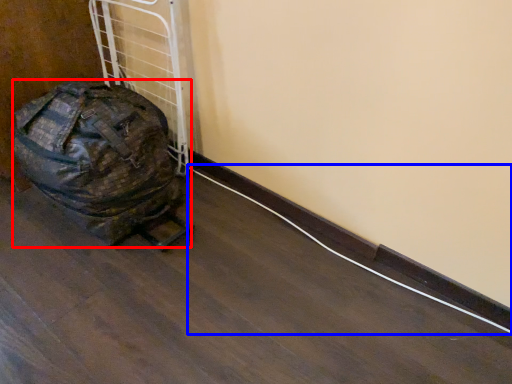
Question: Which point is further to the camera, luggage and bags (highlighted by a red box) or wire (highlighted by a blue box)?

Choices:
 (A) luggage and bags
 (B) wire

Answer: (B)